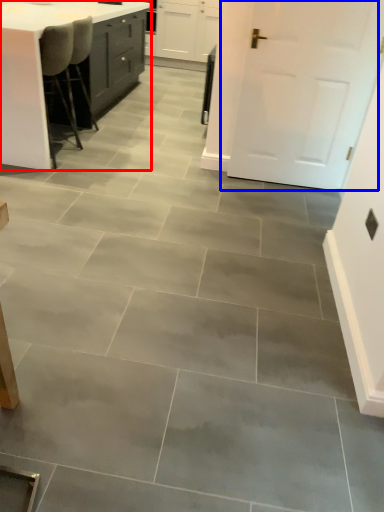
Question: Which object appears farthest to the camera in this image, table (highlighted by a red box) or door (highlighted by a blue box)?

Choices:
 (A) table
 (B) door

Answer: (A)